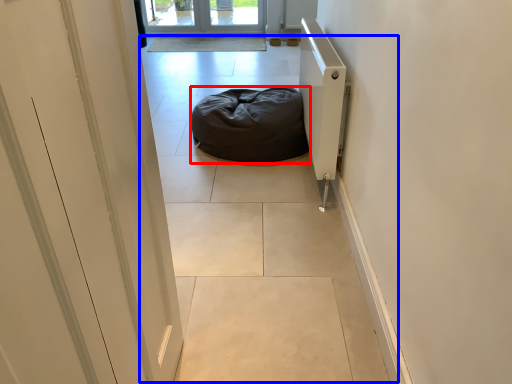
Question: Among these objects, which one is farthest to the camera, furniture (highlighted by a red box) or path (highlighted by a blue box)?

Choices:
 (A) furniture
 (B) path

Answer: (A)